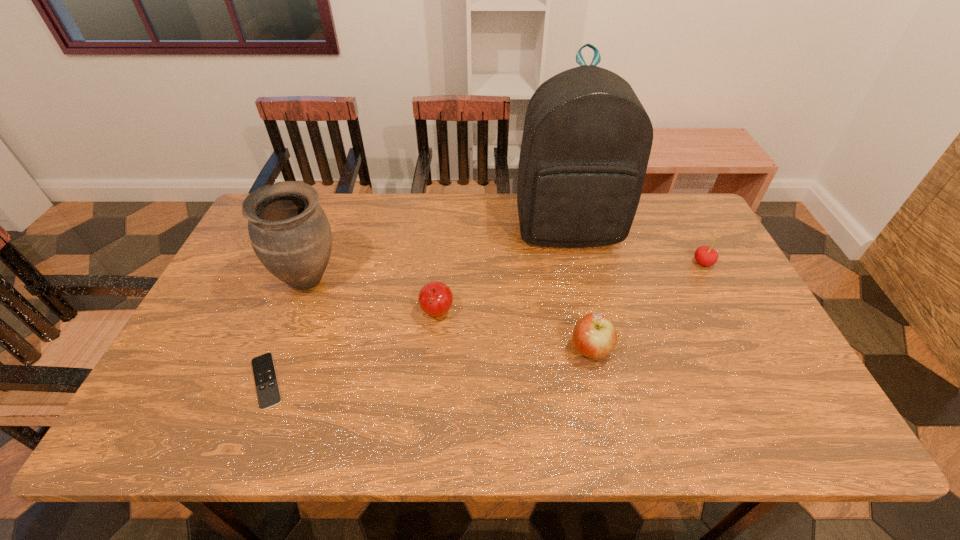
Locate an element on the screen. This screenshot has height=540, width=960. free space that is in between the fifth shortest object and the tallest object is located at coordinates (438, 254).

Where is `free space between the rightmost object and the second tallest object`? This screenshot has height=540, width=960. free space between the rightmost object and the second tallest object is located at coordinates (506, 271).

Where is `free space between the apple and the left cherry`? The height and width of the screenshot is (540, 960). free space between the apple and the left cherry is located at coordinates (514, 332).

Identify which object is the third closest to the shortest object. Please provide its 2D coordinates. Your answer should be formatted as a tuple, i.e. [(x, y)], where the tuple contains the x and y coordinates of a point satisfying the conditions above.

[(587, 139)]

Where is `object that is the fifth closest to the urn`? object that is the fifth closest to the urn is located at coordinates (704, 255).

Find the location of `vacant space that satisfies the following two spatial constraints: 1. on the front-facing side of the right cherry; 2. on the right side of the backpack`. vacant space that satisfies the following two spatial constraints: 1. on the front-facing side of the right cherry; 2. on the right side of the backpack is located at coordinates (575, 263).

Find the location of a particular element. The width and height of the screenshot is (960, 540). blank area in the image that satisfies the following two spatial constraints: 1. on the front-facing side of the right cherry; 2. on the right side of the backpack is located at coordinates (575, 263).